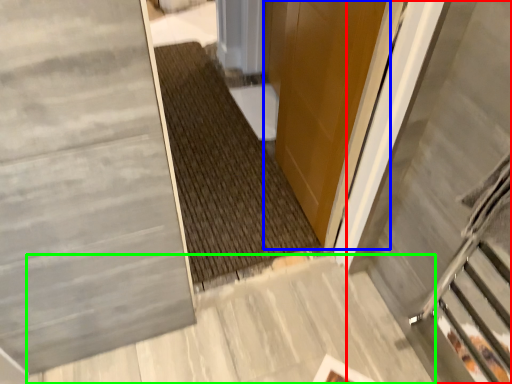
Question: Based on their relative distances, which object is farther from escalator (highlighted by a red box)? Choose from door (highlighted by a blue box) and concrete (highlighted by a green box).

Choices:
 (A) door
 (B) concrete

Answer: (B)